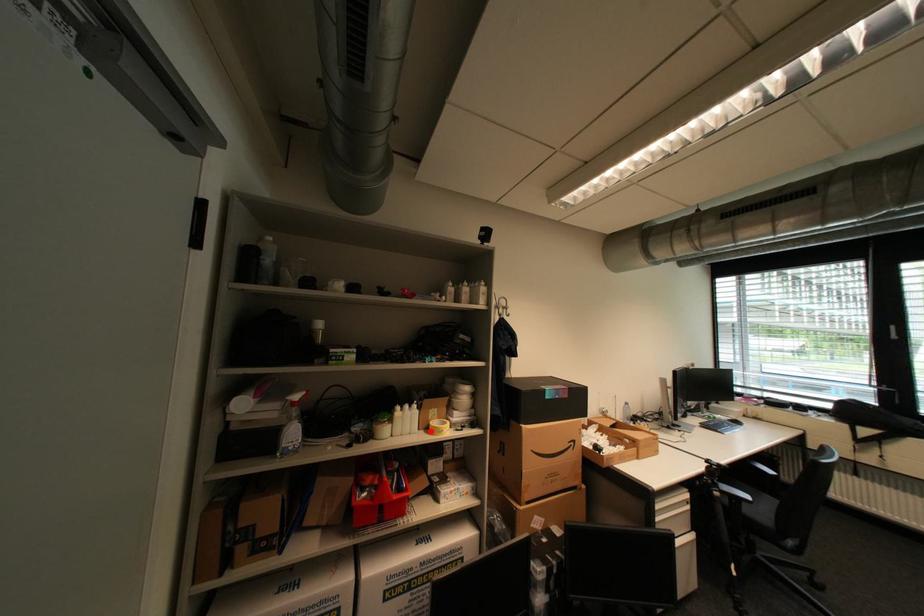
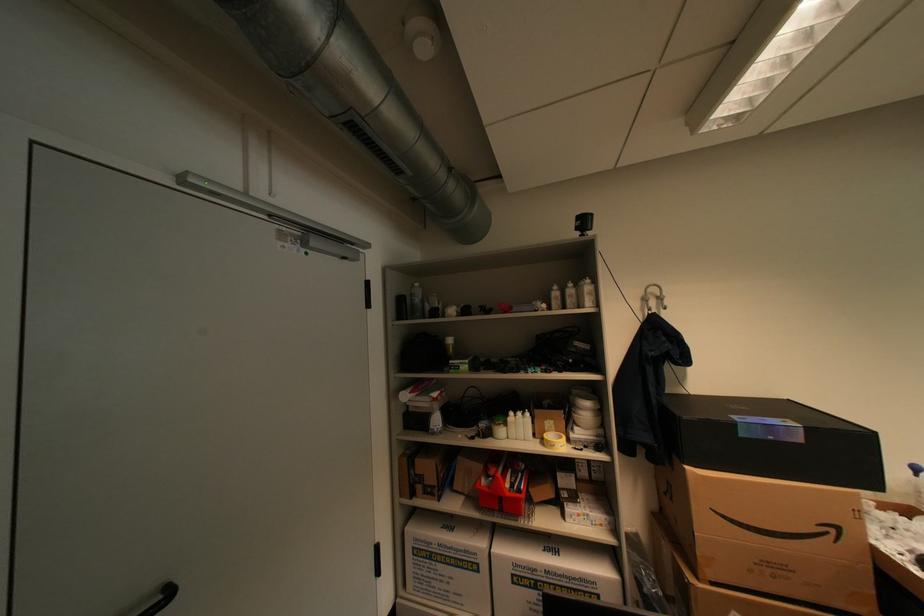
Where in the second image is the point corresponding to the highlighted location from the first image?

(546, 440)